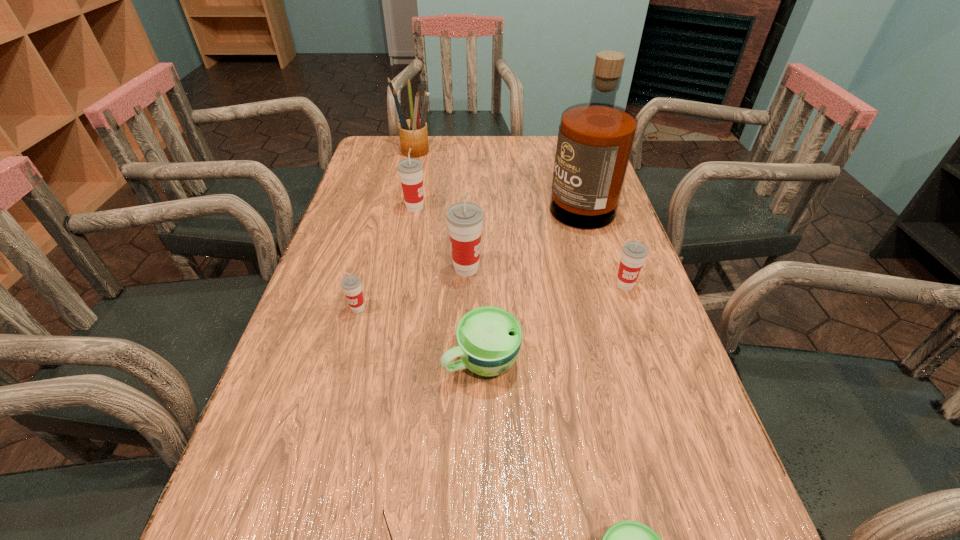
The height and width of the screenshot is (540, 960). In the image, there is a desktop. Identify the location of vacant space at the left edge. tap(357, 335).

Find the location of a particular element. The height and width of the screenshot is (540, 960). free space at the right edge of the desktop is located at coordinates (648, 316).

What are the coordinates of `vacant space at the far left corner of the desktop` in the screenshot? It's located at (385, 139).

I want to click on vacant space at the far right corner of the desktop, so click(x=551, y=152).

What are the coordinates of `free space between the liquor and the seventh farthest object` in the screenshot? It's located at (530, 279).

Find the location of a particular element. The width and height of the screenshot is (960, 540). blank region between the third nearest cup and the fifth shortest object is located at coordinates (492, 296).

Find the location of `vacant region between the nearest red cup and the rightmost red cup`. vacant region between the nearest red cup and the rightmost red cup is located at coordinates (492, 296).

The image size is (960, 540). I want to click on free space between the tallest cup and the farthest cup, so click(x=441, y=238).

The height and width of the screenshot is (540, 960). Identify the location of vacant area that lies between the brown pencil box and the second smallest red cup. (519, 219).

Select which object appears as the second closest to the fifth tallest object. Please provide its 2D coordinates. Your answer should be formatted as a tuple, i.e. [(x, y)], where the tuple contains the x and y coordinates of a point satisfying the conditions above.

[(489, 338)]